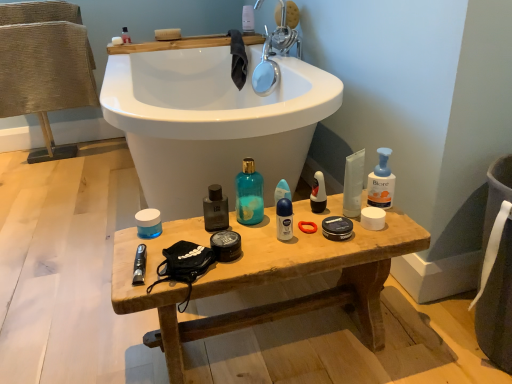
Locate an element on the screen. The height and width of the screenshot is (384, 512). vacant space to the right of white matte deodorant at center, which ranks as the sixth toiletry in top-to-bottom order is located at coordinates (348, 230).